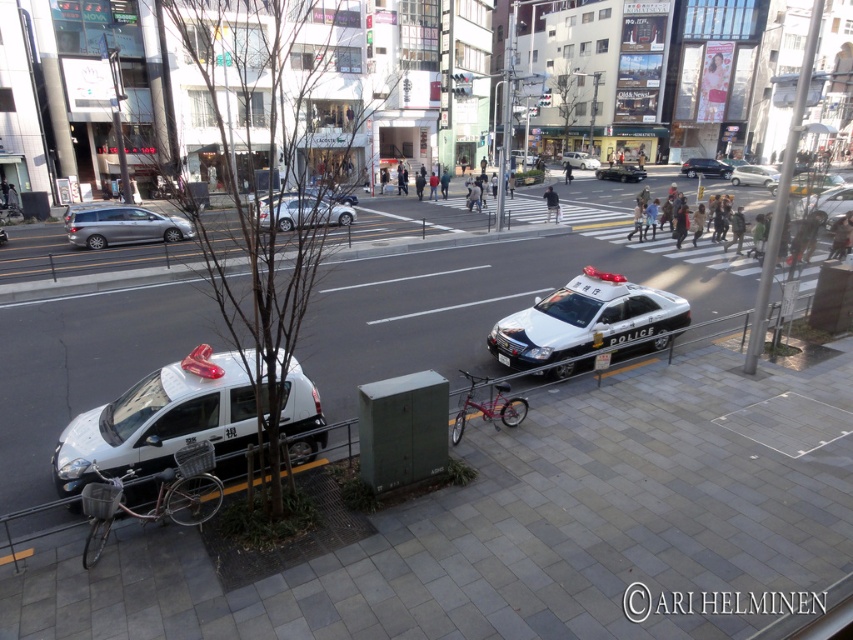
Question: Does white glossy sedan at center have a smaller size compared to shiny black sedan at center?

Choices:
 (A) no
 (B) yes

Answer: (A)

Question: Which point is closer to the camera?

Choices:
 (A) white glossy sedan at center
 (B) white glossy police car at lower left
 (C) matte black sedan at center
 (D) satin silver van at left

Answer: (B)

Question: Does white glossy police car at lower left have a greater width compared to silver metallic sedan at center?

Choices:
 (A) yes
 (B) no

Answer: (B)

Question: Which of the following is the closest to the observer?

Choices:
 (A) matte black sedan at center
 (B) white glossy sedan at center

Answer: (B)

Question: Is white glossy police car at lower left smaller than matte black sedan at center?

Choices:
 (A) no
 (B) yes

Answer: (B)

Question: Which object is positioned closest to the silver metallic sedan at center?

Choices:
 (A) satin silver van at left
 (B) matte black sedan at center
 (C) gray concrete pavement at center
 (D) white glossy police car at center

Answer: (A)